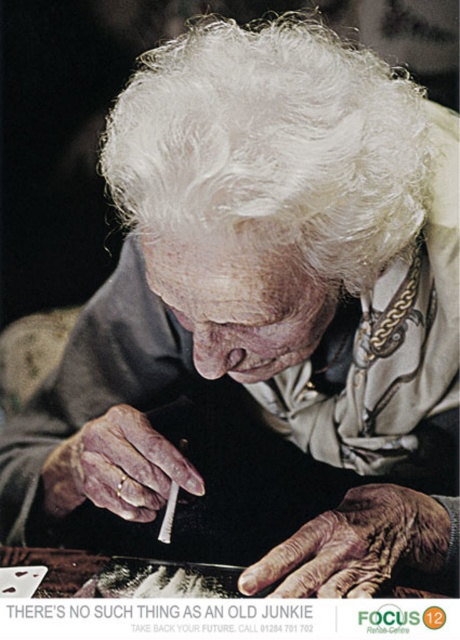
Question: Which point is farther to the camera?

Choices:
 (A) (302, 573)
 (B) (105, 508)

Answer: (B)

Question: Is white fluffy hair at upper center closer to camera compared to white leather cigarette at lower left?

Choices:
 (A) no
 (B) yes

Answer: (B)

Question: Which point is closer to the camera?

Choices:
 (A) (335, 184)
 (B) (402, 588)

Answer: (A)

Question: Which object appears farthest from the camera in this image?

Choices:
 (A) white matte cigarette at center
 (B) white leather cigarette at lower left
 (C) white fluffy hair at upper center
 (D) dry wrinkled hand at lower center

Answer: (B)

Question: Is white fluffy hair at upper center to the right of wooden table at lower center from the viewer's perspective?

Choices:
 (A) yes
 (B) no

Answer: (A)

Question: Where is white leather cigarette at lower left located in relation to wooden table at lower center in the image?

Choices:
 (A) above
 (B) below

Answer: (A)